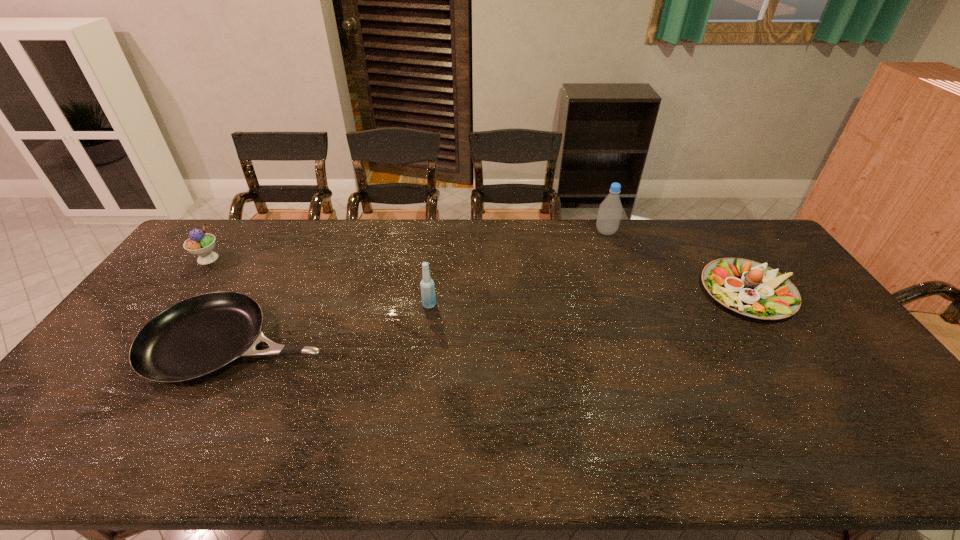
You are a GUI agent. You are given a task and a screenshot of the screen. Output one action in this format:
    pyautogui.click(x=<x>, y=<y>)
    Task: Click on the taller bottle
    
    Given the screenshot: What is the action you would take?
    pyautogui.click(x=610, y=210)

Identify the location of the farther bottle. (610, 210).

At what (x,y) coordinates should I click in order to perform the action: click on the shorter bottle. Please return your answer as a coordinate pair (x, y). The image size is (960, 540). Looking at the image, I should click on (428, 295).

Image resolution: width=960 pixels, height=540 pixels. In order to click on the nearer bottle in this screenshot , I will do `click(428, 295)`.

Image resolution: width=960 pixels, height=540 pixels. What are the coordinates of `icecream` in the screenshot? It's located at (201, 244).

The width and height of the screenshot is (960, 540). I want to click on salad plate, so click(x=747, y=287).

Locate an element on the screen. The height and width of the screenshot is (540, 960). the second shortest object is located at coordinates (747, 287).

Where is `pan`? This screenshot has width=960, height=540. pan is located at coordinates (199, 336).

You are a GUI agent. You are given a task and a screenshot of the screen. Output one action in this format:
    pyautogui.click(x=<x>, y=<y>)
    Task: Click on the vacant region located 0.070m on the right of the right bottle
    
    Given the screenshot: What is the action you would take?
    pyautogui.click(x=636, y=232)

Find the location of a particular element. This screenshot has height=540, width=960. vacant space situated 0.180m on the left of the left bottle is located at coordinates (364, 305).